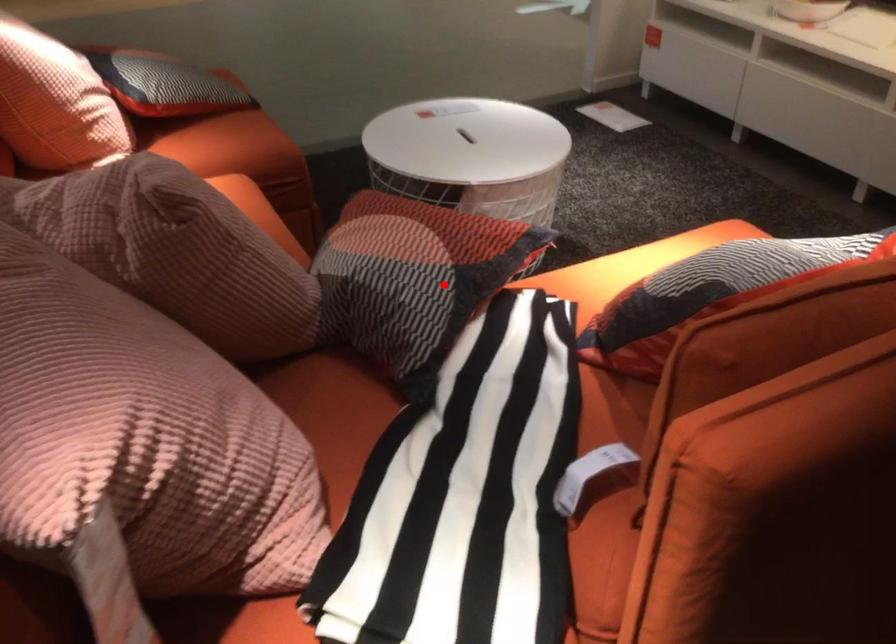
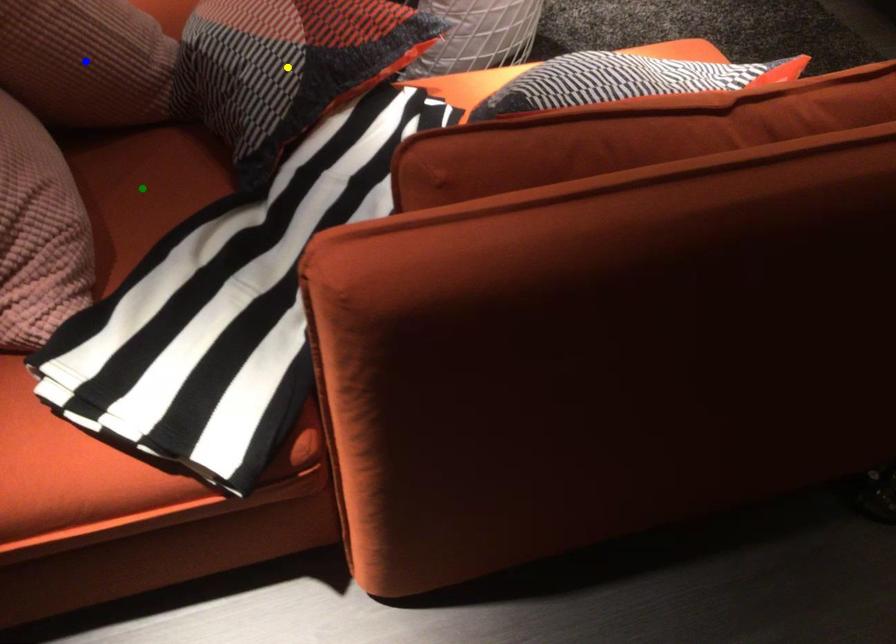
Question: I am providing you with two images of the same scene from different viewpoints. A red point is marked on the first image. You are given multiple points on the second image. In image 2, which mark is for the same physical point as the one in image 1?

Choices:
 (A) blue point
 (B) yellow point
 (C) green point

Answer: (B)